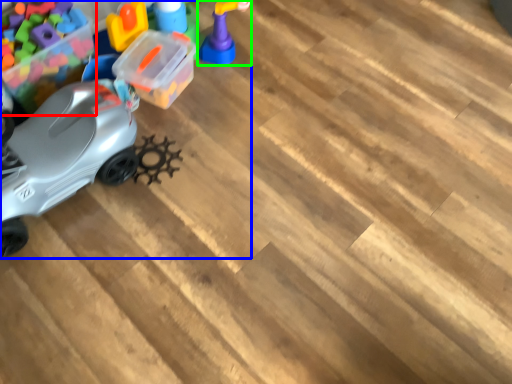
Question: Considering the real-world distances, which object is closest to toy (highlighted by a red box)? toy (highlighted by a blue box) or toy (highlighted by a green box).

Choices:
 (A) toy
 (B) toy

Answer: (A)